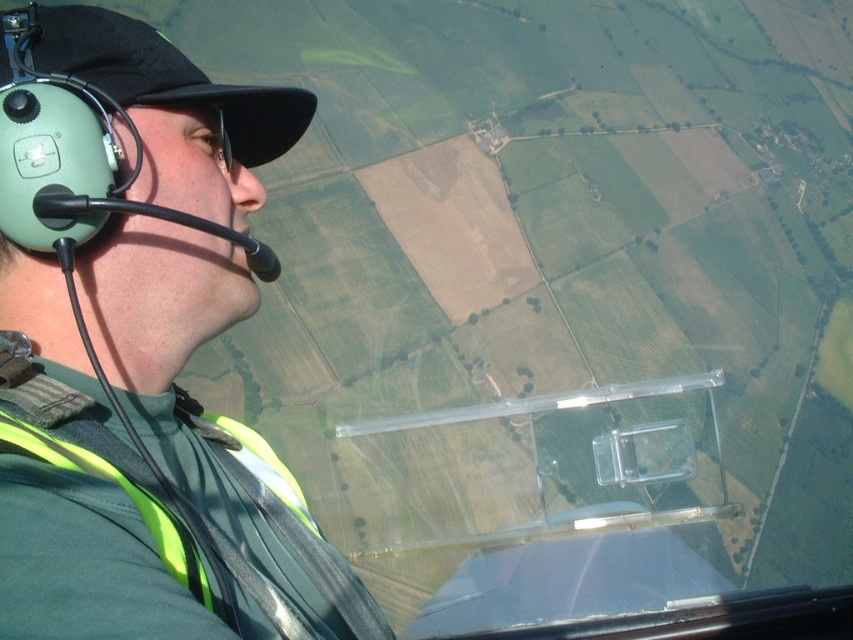
From the picture: You are a passenger in the cockpit and need to locate the green matte helmet at upper left and the neon yellow reflective safety vest at left. Which object is placed higher in the cockpit?

The green matte helmet at upper left is positioned over the neon yellow reflective safety vest at left, so it is placed higher in the cockpit.

You are a flight attendant checking the cockpit for safety equipment. You notice the green matte helmet at upper left and the neon yellow reflective safety vest at left. Which one is bigger in size?

The green matte helmet at upper left has a larger size compared to the neon yellow reflective safety vest at left.

You are a maintenance technician in the cockpit and need to reach both the green matte helmet at upper left and the neon yellow reflective safety vest at left. Which one is closer to your current position?

The green matte helmet at upper left and neon yellow reflective safety vest at left are 3.53 inches apart from each other, so without knowing your exact position, it is impossible to determine which one is closer.